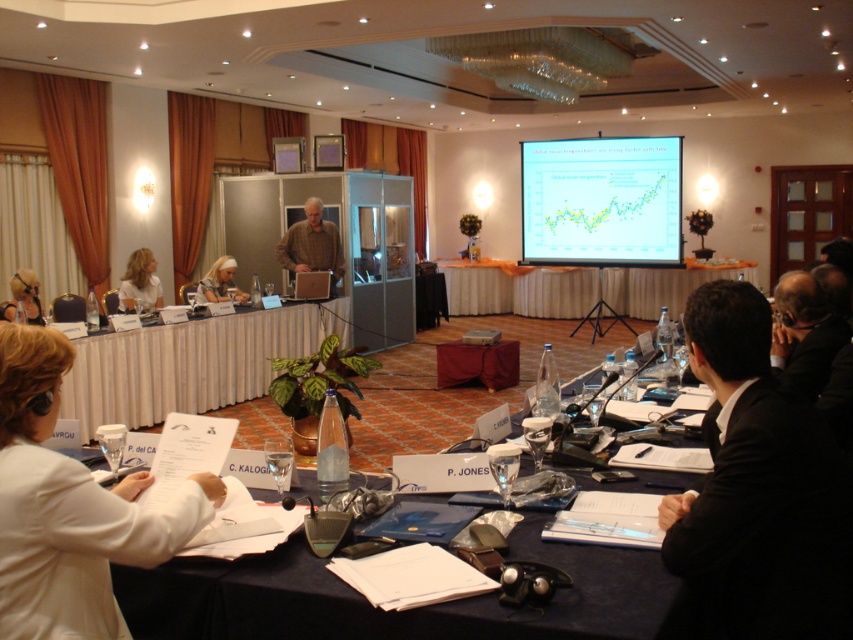
Does black suit at right appear under white hair at center?

Yes, black suit at right is below white hair at center.

Between black suit at right and white hair at center, which one has more height?

Standing taller between the two is black suit at right.

Is point (694, 291) less distant than point (207, 278)?

Yes.

Find the location of a particular element. The image size is (853, 640). black suit at right is located at coordinates (756, 493).

Which is below, matte black laptop at left or white hair at center?

matte black laptop at left is lower down.

Does matte black laptop at left have a greater width compared to white hair at center?

Incorrect, matte black laptop at left's width does not surpass white hair at center's.

Where is `matte black laptop at left`? matte black laptop at left is located at coordinates (22, 298).

Find the location of `matte black laptop at left`. matte black laptop at left is located at coordinates (22, 298).

Can you confirm if white paper at center is wider than matte white projection screen at upper center?

No.

I want to click on white paper at center, so click(x=68, y=508).